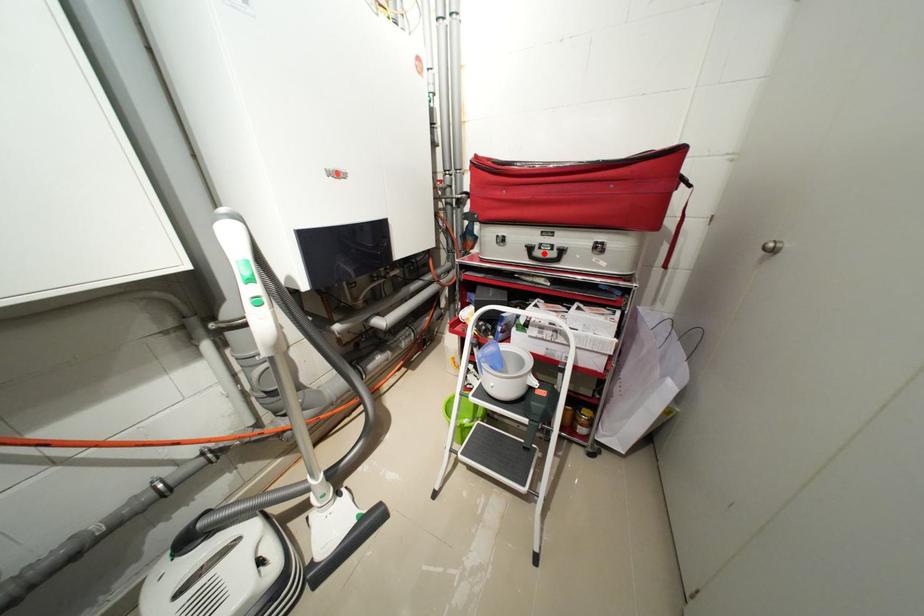
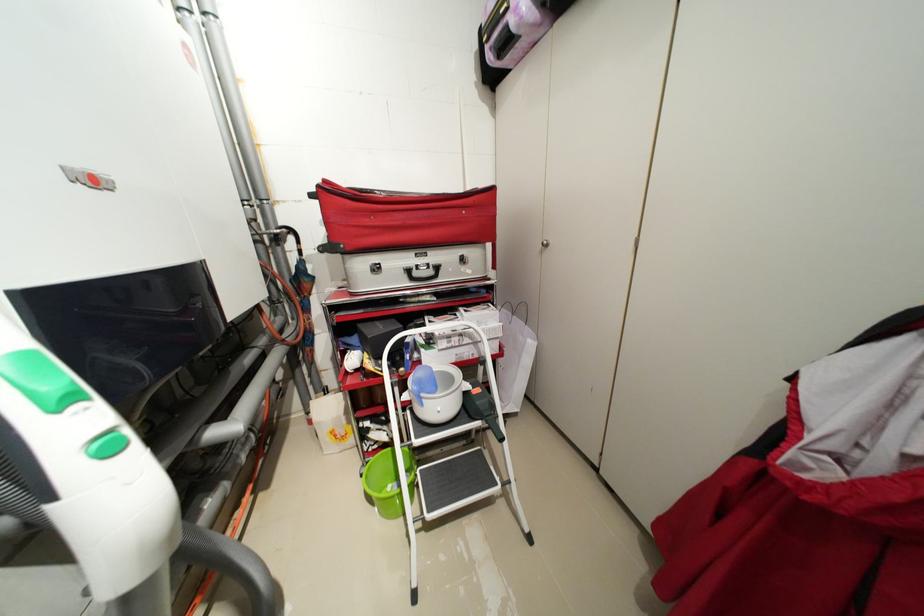
Locate, in the second image, the point that corresponds to the highlighted location in the first image.

(422, 275)